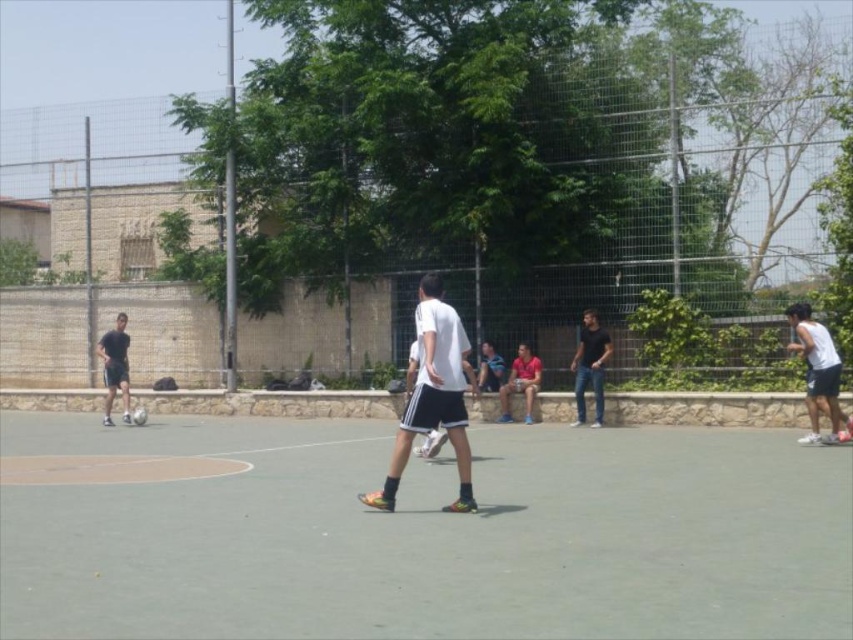
Question: Which of the following is the farthest from the observer?

Choices:
 (A) green rubber court at center
 (B) blue denim shorts at center

Answer: (B)

Question: Which object is the closest to the dark blue jeans at center?

Choices:
 (A) white matte tank top at right
 (B) matte red shirt at center
 (C) matte black shorts at left

Answer: (B)

Question: Which of the following is the closest to the observer?

Choices:
 (A) (827, 381)
 (B) (457, 461)
 (C) (482, 346)
 (D) (578, 349)

Answer: (B)

Question: Is dark blue jeans at center in front of matte red shirt at center?

Choices:
 (A) no
 (B) yes

Answer: (B)

Question: Is white matte shorts at center to the left of white matte tank top at right from the viewer's perspective?

Choices:
 (A) yes
 (B) no

Answer: (A)

Question: In this image, where is dark blue jeans at center located relative to matte red shirt at center?

Choices:
 (A) below
 (B) above

Answer: (B)